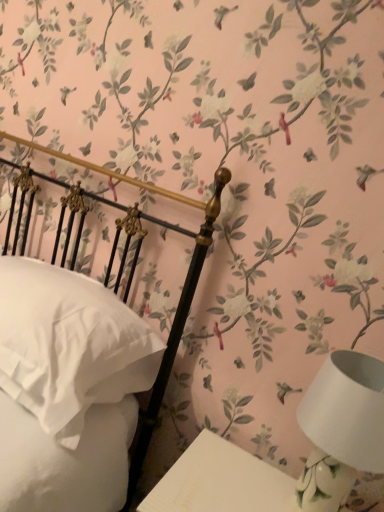
Question: Is white soft pillow at left inside or outside of white ceramic table lamp at lower right?

Choices:
 (A) inside
 (B) outside

Answer: (B)

Question: In the image, is white soft pillow at left positioned in front of or behind white ceramic table lamp at lower right?

Choices:
 (A) behind
 (B) front

Answer: (A)

Question: Considering the real-world distances, which object is farthest from the white ceramic table lamp at lower right?

Choices:
 (A) white glossy table at lower right
 (B) white soft pillow at left

Answer: (B)

Question: Which object is the closest to the white glossy table at lower right?

Choices:
 (A) white soft pillow at left
 (B) white ceramic table lamp at lower right

Answer: (B)